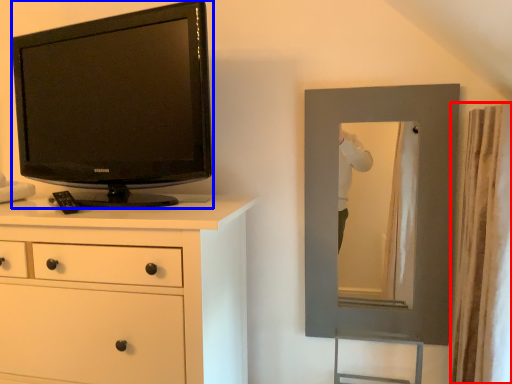
Question: Among these objects, which one is farthest to the camera, curtain (highlighted by a red box) or television (highlighted by a blue box)?

Choices:
 (A) curtain
 (B) television

Answer: (B)